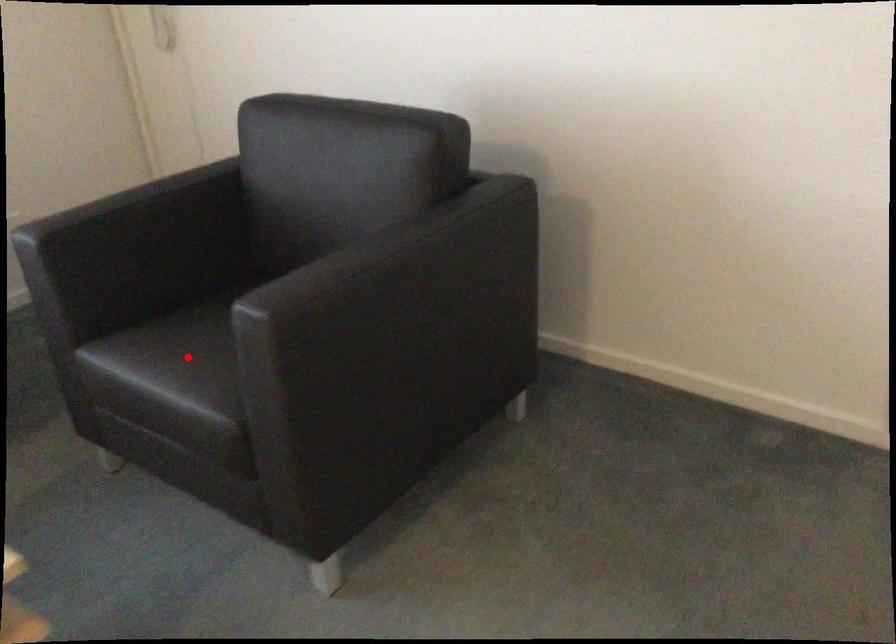
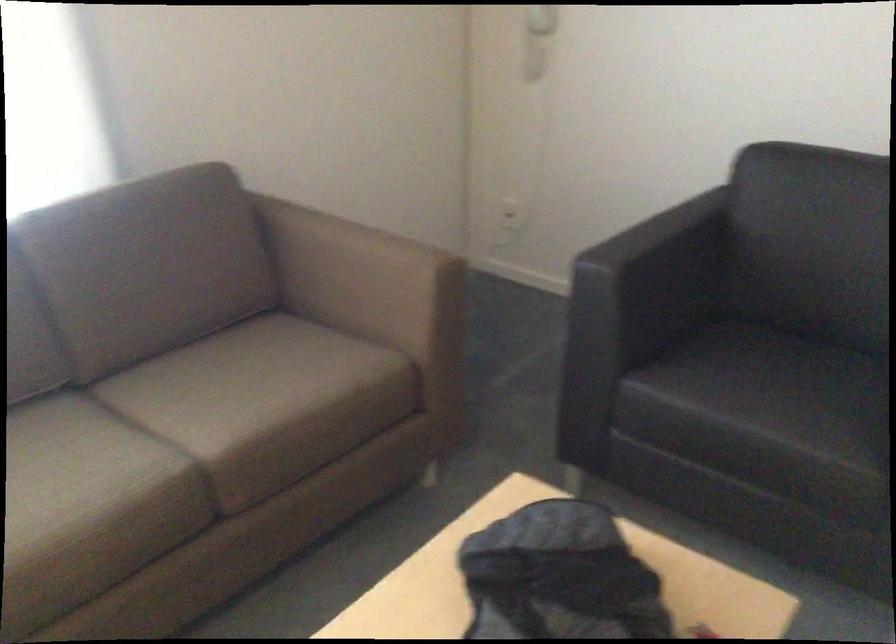
In the second image, find the point that corresponds to the highlighted location in the first image.

(765, 397)